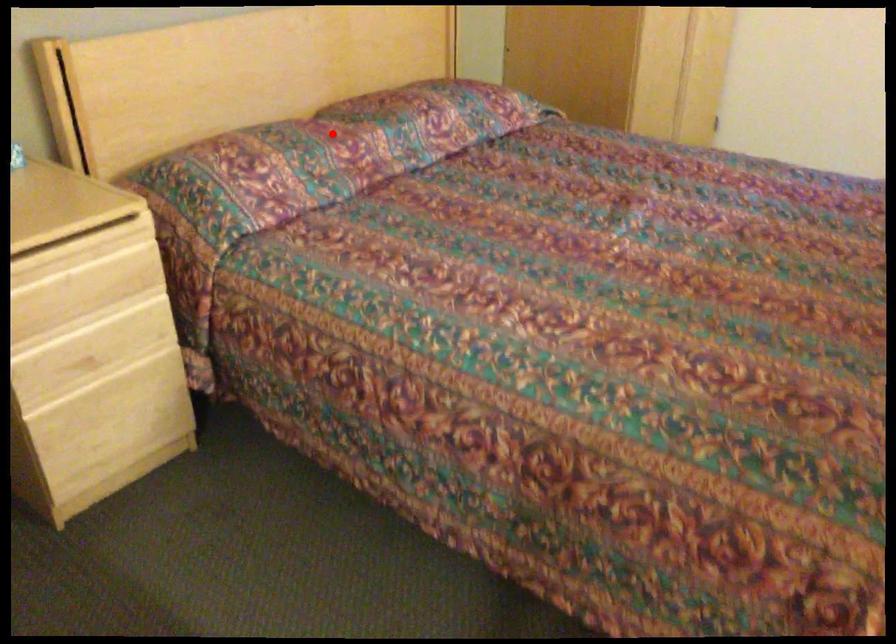
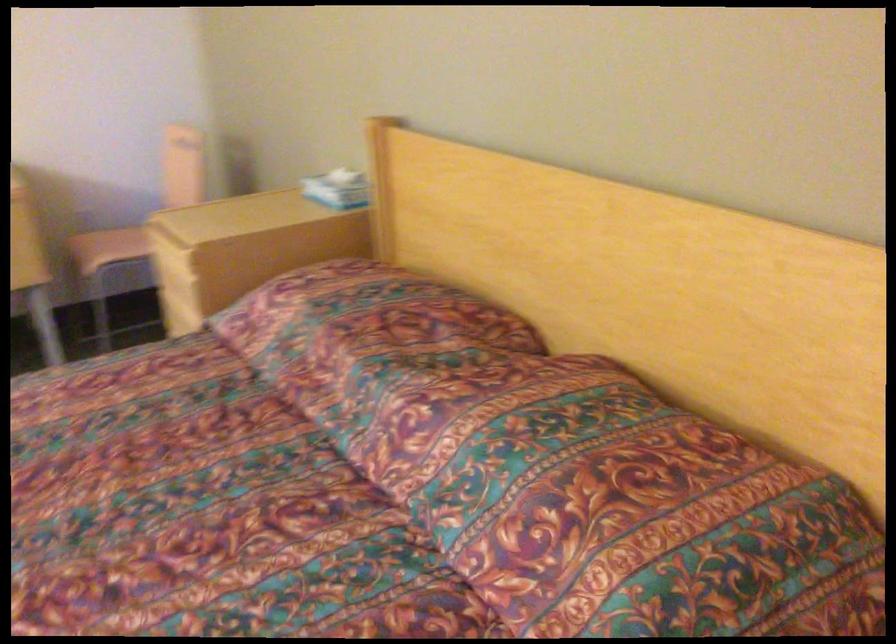
Question: I am providing you with two images of the same scene from different viewpoints. A red point is marked on the first image. Can you still see the location of the red point in image 2?

Choices:
 (A) Yes
 (B) No

Answer: (A)